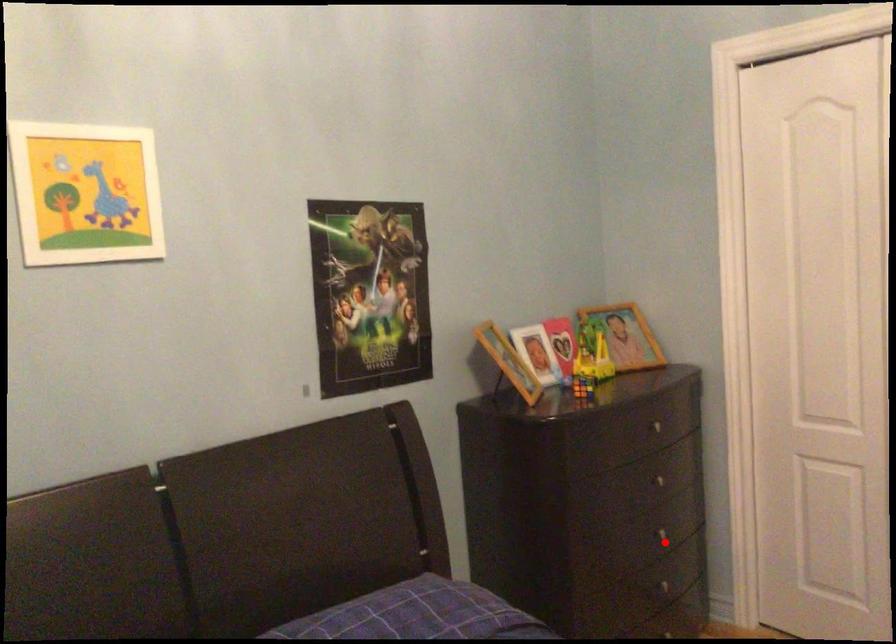
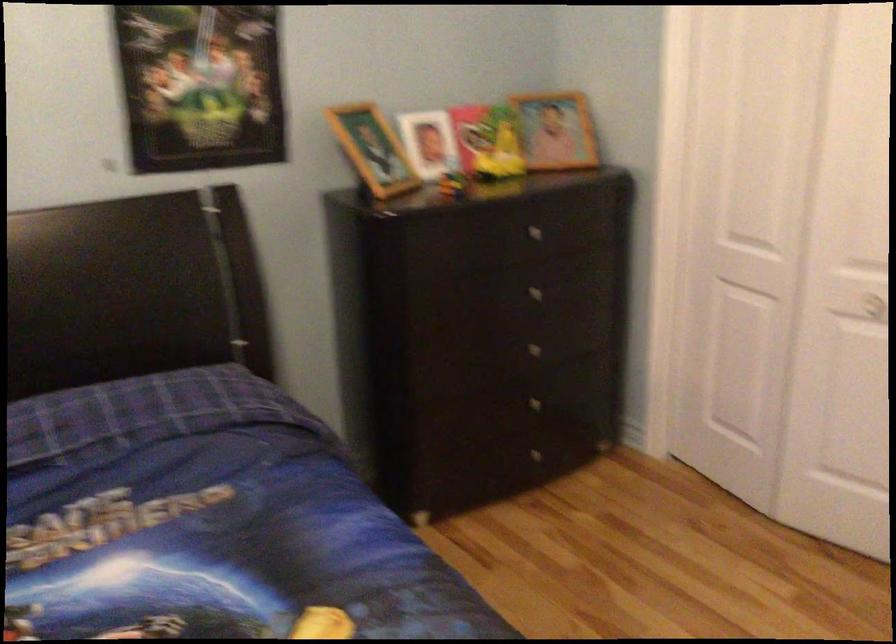
Find the pixel in the second image that matches the highlighted location in the first image.

(539, 353)